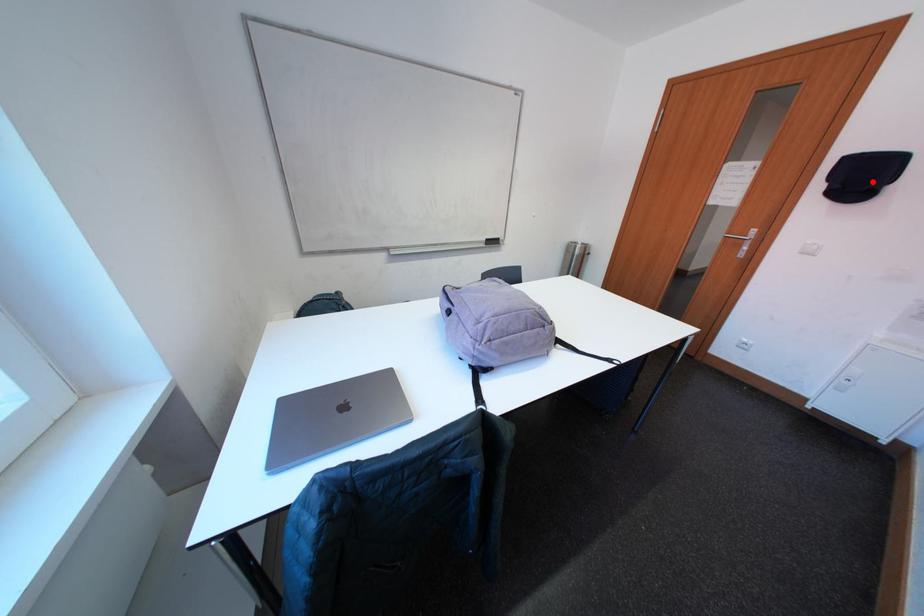
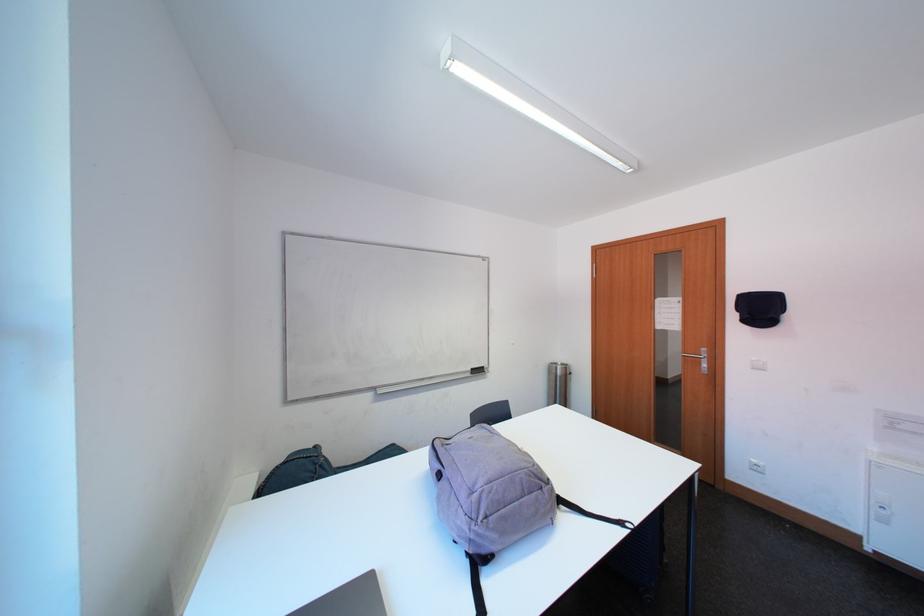
Locate, in the second image, the point that corresponds to the highlighted location in the first image.

(771, 313)